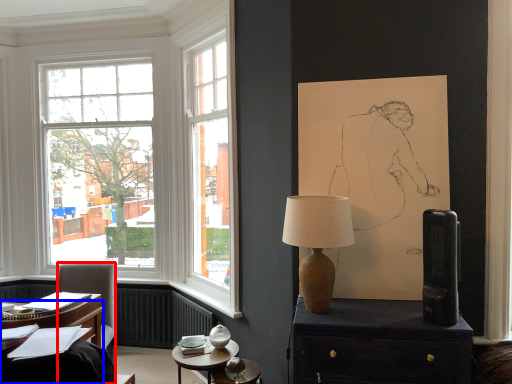
Question: Among these objects, which one is farthest to the camera, chair (highlighted by a red box) or desk (highlighted by a blue box)?

Choices:
 (A) chair
 (B) desk

Answer: (A)